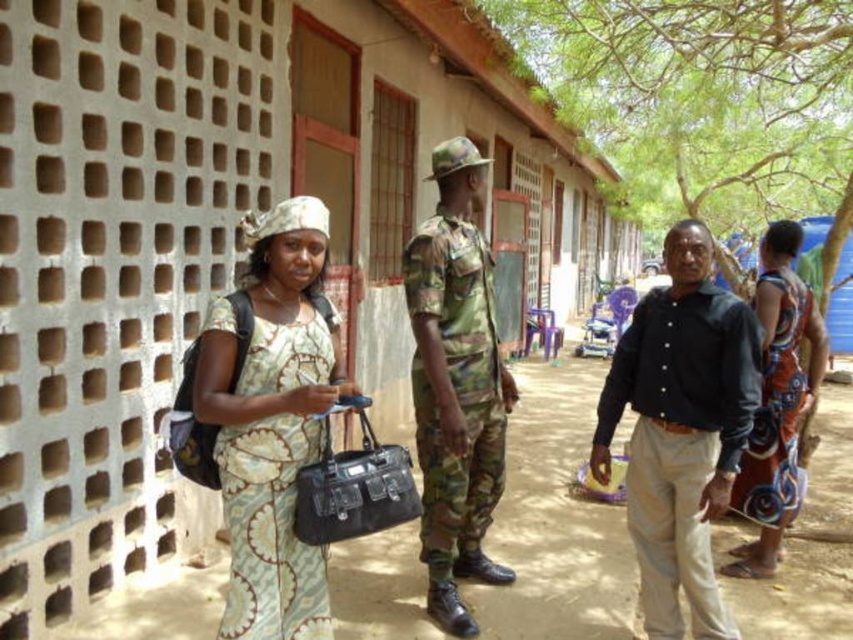
Where is `camouflage fabric uniform at center`? The height and width of the screenshot is (640, 853). camouflage fabric uniform at center is located at coordinates (456, 385).

Which is behind, point (444, 272) or point (790, 236)?

Point (790, 236)

Identify the location of camouflage fabric uniform at center. [x=456, y=385].

Does black cotton shirt at center appear on the left side of camouflage fabric uniform at center?

Incorrect, black cotton shirt at center is not on the left side of camouflage fabric uniform at center.

Is point (729, 396) farther from camera compared to point (433, 339)?

No.

Between point (704, 307) and point (448, 205), which one is positioned in front?

Positioned in front is point (704, 307).

In order to click on black cotton shirt at center in this screenshot , I will do `click(682, 429)`.

Looking at this image, which is more to the left, patterned fabric dress at center or printed fabric dress at right?

patterned fabric dress at center is more to the left.

Does patterned fabric dress at center have a lesser width compared to printed fabric dress at right?

Yes, patterned fabric dress at center is thinner than printed fabric dress at right.

The width and height of the screenshot is (853, 640). I want to click on patterned fabric dress at center, so click(x=271, y=420).